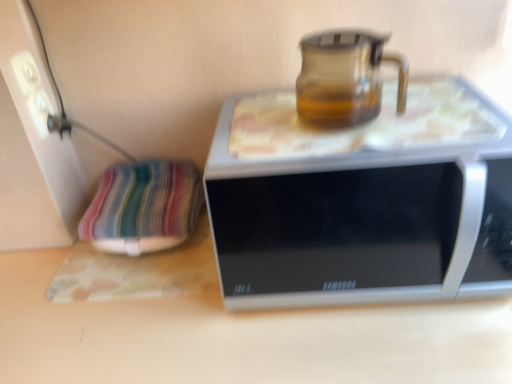
The image size is (512, 384). Describe the element at coordinates (143, 207) in the screenshot. I see `striped fabric pillow at left` at that location.

What do you see at coordinates (362, 201) in the screenshot? This screenshot has height=384, width=512. I see `silver metallic microwave at center` at bounding box center [362, 201].

What is the approximate width of smooth wooden table at center?

smooth wooden table at center is 21.99 inches wide.

In order to face smooth wooden table at center, should I rotate leftwards or rightwards?

To align with it, rotate left about 9.845°.

Where is `transparent glass jug at upper center`? transparent glass jug at upper center is located at coordinates (345, 78).

The width and height of the screenshot is (512, 384). I want to click on white plastic socket at upper left, so click(x=26, y=72).

Based on the photo, is transparent glass jug at upper center bigger than white plastic socket at upper left?

Yes.

Can you tell me how much transparent glass jug at upper center and white plastic socket at upper left differ in facing direction?

The facing directions of transparent glass jug at upper center and white plastic socket at upper left are 91.8 degrees apart.

Between transparent glass jug at upper center and white plastic socket at upper left, which one has less height?

white plastic socket at upper left is shorter.

Which object is positioned more to the left, transparent glass jug at upper center or white plastic socket at upper left?

white plastic socket at upper left is more to the left.

Looking at this image, is white plastic socket at upper left spatially inside silver metallic microwave at center, or outside of it?

white plastic socket at upper left is spatially situated outside silver metallic microwave at center.

From the image's perspective, which object appears higher, white plastic socket at upper left or silver metallic microwave at center?

white plastic socket at upper left appears higher in the image.

In the scene shown: Who is bigger, white plastic socket at upper left or silver metallic microwave at center?

silver metallic microwave at center.

From the picture: In terms of height, does white plastic socket at upper left look taller or shorter compared to silver metallic microwave at center?

Considering their sizes, white plastic socket at upper left has less height than silver metallic microwave at center.

From the image's perspective, is white plastic socket at upper left above or below striped fabric pillow at left?

Based on their image positions, white plastic socket at upper left is located above striped fabric pillow at left.

How far apart are white plastic socket at upper left and striped fabric pillow at left?

white plastic socket at upper left and striped fabric pillow at left are 31.41 centimeters apart from each other.

In terms of height, does white plastic socket at upper left look taller or shorter compared to striped fabric pillow at left?

In the image, white plastic socket at upper left appears to be shorter than striped fabric pillow at left.

Can you confirm if white plastic socket at upper left is bigger than striped fabric pillow at left?

Actually, white plastic socket at upper left might be smaller than striped fabric pillow at left.

Can you confirm if silver metallic microwave at center is positioned to the right of smooth wooden table at center?

Yes.

Considering the sizes of silver metallic microwave at center and smooth wooden table at center in the image, is silver metallic microwave at center wider or thinner than smooth wooden table at center?

silver metallic microwave at center is thinner than smooth wooden table at center.

Where is `surface on the left of silver metallic microwave at center`? The image size is (512, 384). surface on the left of silver metallic microwave at center is located at coordinates (237, 334).

Is silver metallic microwave at center located outside transparent glass jug at upper center?

Yes, silver metallic microwave at center is located beyond the bounds of transparent glass jug at upper center.

From a real-world perspective, which is physically below, silver metallic microwave at center or transparent glass jug at upper center?

In real-world perspective, silver metallic microwave at center is lower.

Which is closer to the camera, (426,140) or (343,34)?

Point (426,140) is positioned closer to the camera compared to point (343,34).

Is silver metallic microwave at center aimed at transparent glass jug at upper center?

No, silver metallic microwave at center is not facing towards transparent glass jug at upper center.

In terms of size, does white plastic socket at upper left appear bigger or smaller than smooth wooden table at center?

Clearly, white plastic socket at upper left is smaller in size than smooth wooden table at center.

How different are the orientations of white plastic socket at upper left and smooth wooden table at center in degrees?

The angle between the facing direction of white plastic socket at upper left and the facing direction of smooth wooden table at center is 90 degrees.

Between white plastic socket at upper left and smooth wooden table at center, which one has smaller width?

Thinner between the two is white plastic socket at upper left.

Consider the image. From a real-world perspective, between white plastic socket at upper left and smooth wooden table at center, who is vertically higher?

white plastic socket at upper left, from a real-world perspective.

The image size is (512, 384). Identify the location of pillow that is above the smooth wooden table at center (from a real-world perspective). click(143, 207).

From a real-world perspective, which is physically above, smooth wooden table at center or striped fabric pillow at left?

In real-world perspective, striped fabric pillow at left is above.

Consider the image. Which is more to the right, smooth wooden table at center or striped fabric pillow at left?

From the viewer's perspective, smooth wooden table at center appears more on the right side.

Where is `jug below the white plastic socket at upper left (from a real-world perspective)`? The width and height of the screenshot is (512, 384). jug below the white plastic socket at upper left (from a real-world perspective) is located at coordinates (345, 78).

I want to click on electric outlet lying on the left of silver metallic microwave at center, so click(x=26, y=72).

Based on their spatial positions, is silver metallic microwave at center or white plastic socket at upper left further from smooth wooden table at center?

white plastic socket at upper left is positioned further to the anchor smooth wooden table at center.

Based on the photo, estimate the real-world distances between objects in this image. Which object is further from silver metallic microwave at center, smooth wooden table at center or striped fabric pillow at left?

The object further to silver metallic microwave at center is striped fabric pillow at left.

Estimate the real-world distances between objects in this image. Which object is further from transparent glass jug at upper center, smooth wooden table at center or silver metallic microwave at center?

smooth wooden table at center lies further to transparent glass jug at upper center than the other object.

Estimate the real-world distances between objects in this image. Which object is further from smooth wooden table at center, striped fabric pillow at left or white plastic socket at upper left?

The object further to smooth wooden table at center is white plastic socket at upper left.

Considering their positions, is silver metallic microwave at center positioned closer to transparent glass jug at upper center than white plastic socket at upper left?

silver metallic microwave at center.

Looking at the image, which one is located closer to transparent glass jug at upper center, silver metallic microwave at center or striped fabric pillow at left?

silver metallic microwave at center.

Based on their spatial positions, is striped fabric pillow at left or white plastic socket at upper left closer to silver metallic microwave at center?

striped fabric pillow at left.

Which object lies nearer to the anchor point silver metallic microwave at center, white plastic socket at upper left or transparent glass jug at upper center?

transparent glass jug at upper center is positioned closer to the anchor silver metallic microwave at center.

Identify the location of pillow between white plastic socket at upper left and smooth wooden table at center vertically. The height and width of the screenshot is (384, 512). (143, 207).

This screenshot has width=512, height=384. I want to click on pillow located between white plastic socket at upper left and transparent glass jug at upper center in the left-right direction, so click(x=143, y=207).

Locate an element on the screen. This screenshot has width=512, height=384. microwave oven that lies between white plastic socket at upper left and smooth wooden table at center from top to bottom is located at coordinates (362, 201).

Image resolution: width=512 pixels, height=384 pixels. What are the coordinates of `jug between white plastic socket at upper left and smooth wooden table at center in the vertical direction` in the screenshot? It's located at (345, 78).